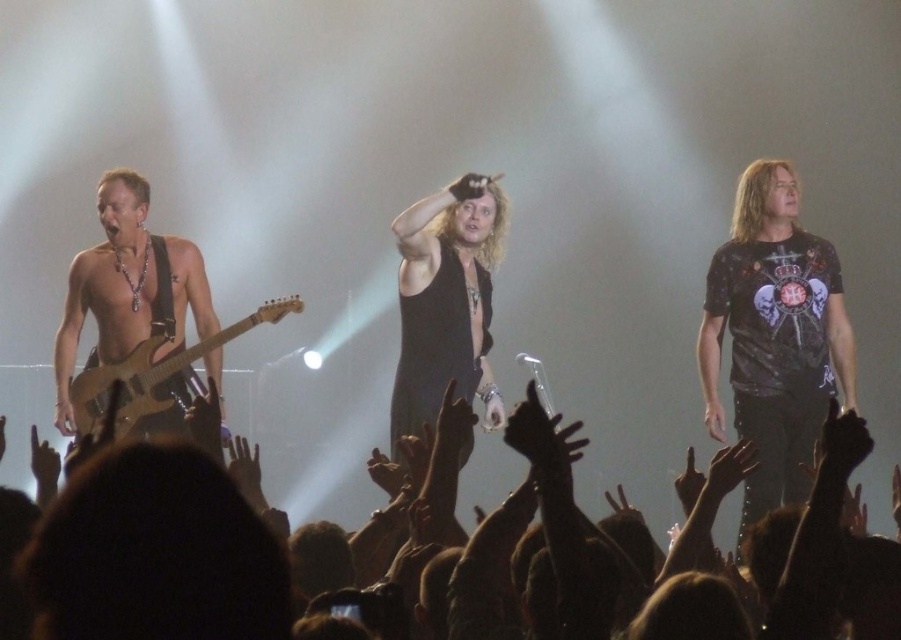
You are a stagehand setting up the next act. You need to place a new amplifier that is 12 inches wide between the shiny silver guitar at left and the wooden electric guitar at left. Can the amplifier fit between them based on their widths?

The shiny silver guitar at left is thinner than the wooden electric guitar at left. Since the amplifier is 12 inches wide, we need to know the exact width difference to determine if it fits. However, the description only states which is thinner, not the specific measurements. Therefore, it is impossible to confirm if the amplifier can fit without additional information.

You are a photographer in the front row of the concert. You want to take a photo of the shiny silver guitar at left and the wooden electric guitar at left. Which one is positioned further to the left?

The shiny silver guitar at left is positioned further to the left than the wooden electric guitar at left.